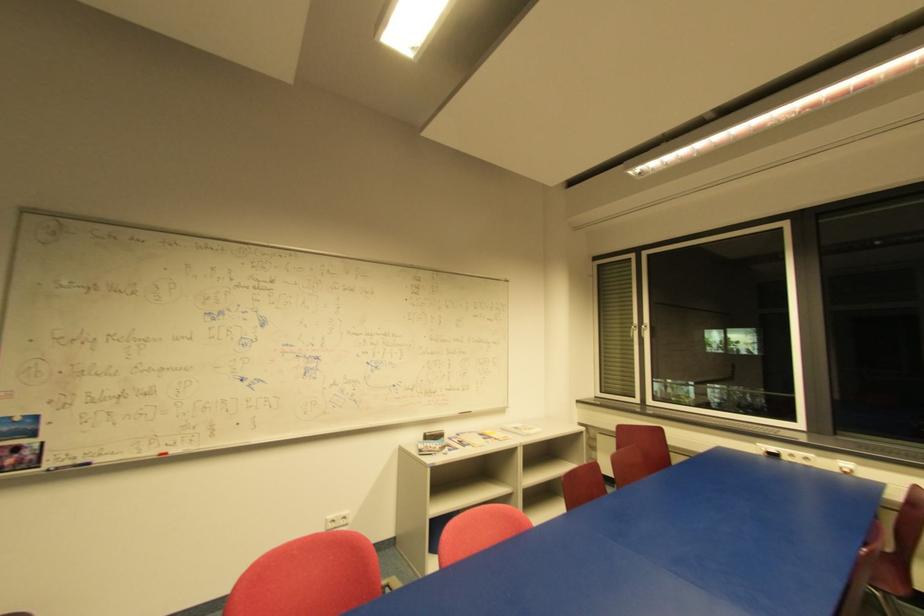
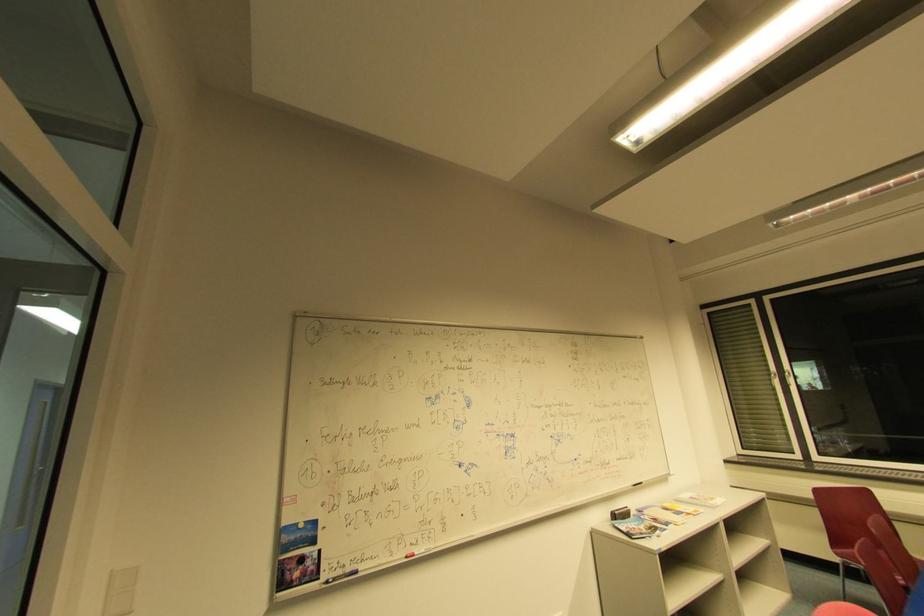
Question: In a continuous first-person perspective shot, in which direction is the camera moving?

Choices:
 (A) Left
 (B) Right
 (C) Forward
 (D) Backward

Answer: (A)